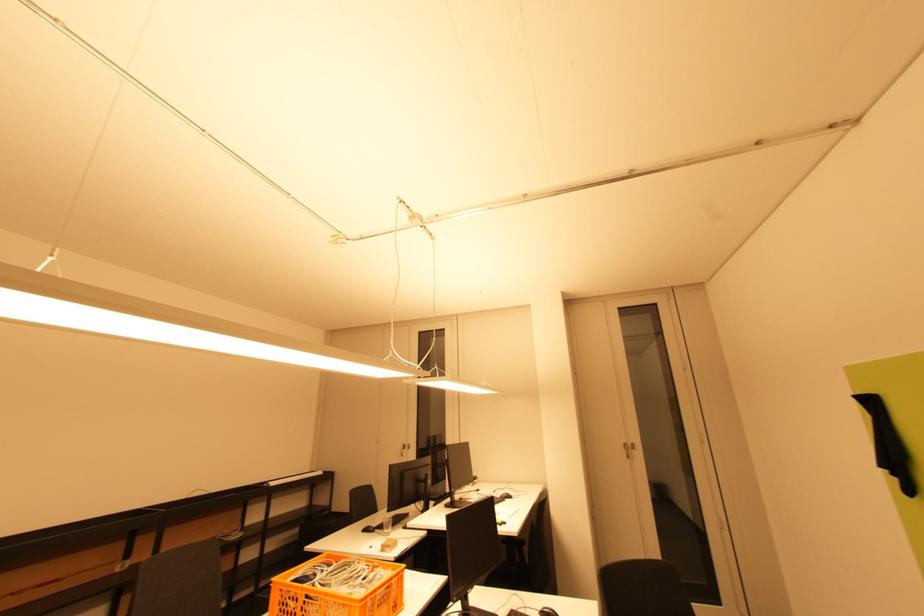
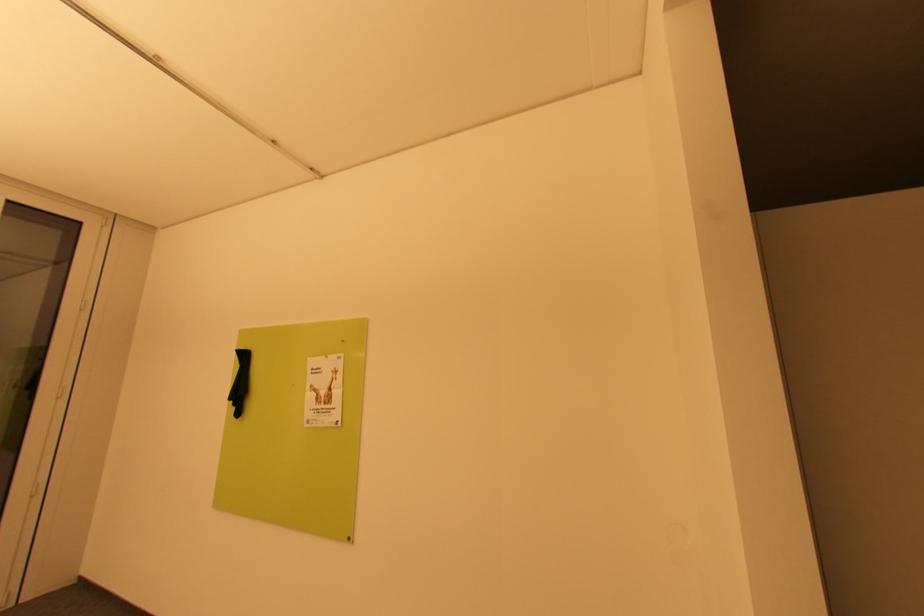
Question: The camera is either moving clockwise (left) or counter-clockwise (right) around the object. The first image is from the beginning of the video and the second image is from the end. Is the camera moving left or right when shooting the video?

Choices:
 (A) Left
 (B) Right

Answer: (A)